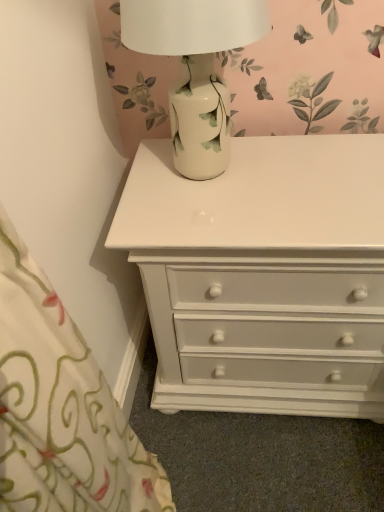
Question: Is porcelain vase at upper center far away from white glossy chest of drawers at center?

Choices:
 (A) no
 (B) yes

Answer: (A)

Question: From a real-world perspective, does porcelain vase at upper center sit lower than white glossy chest of drawers at center?

Choices:
 (A) no
 (B) yes

Answer: (A)

Question: Does porcelain vase at upper center have a lesser height compared to white glossy chest of drawers at center?

Choices:
 (A) no
 (B) yes

Answer: (B)

Question: Does porcelain vase at upper center have a greater height compared to white glossy chest of drawers at center?

Choices:
 (A) no
 (B) yes

Answer: (A)

Question: From a real-world perspective, is porcelain vase at upper center physically above white glossy chest of drawers at center?

Choices:
 (A) yes
 (B) no

Answer: (A)

Question: Is porcelain vase at upper center further to the viewer compared to white glossy chest of drawers at center?

Choices:
 (A) no
 (B) yes

Answer: (A)

Question: From the image's perspective, does white glossy chest of drawers at center appear higher than porcelain vase at upper center?

Choices:
 (A) no
 (B) yes

Answer: (A)

Question: From a real-world perspective, is white glossy chest of drawers at center located beneath porcelain vase at upper center?

Choices:
 (A) yes
 (B) no

Answer: (A)

Question: Is white glossy chest of drawers at center aimed at porcelain vase at upper center?

Choices:
 (A) yes
 (B) no

Answer: (B)

Question: Can you confirm if white glossy chest of drawers at center is bigger than porcelain vase at upper center?

Choices:
 (A) yes
 (B) no

Answer: (A)

Question: Considering the relative sizes of white glossy chest of drawers at center and porcelain vase at upper center in the image provided, is white glossy chest of drawers at center smaller than porcelain vase at upper center?

Choices:
 (A) yes
 (B) no

Answer: (B)

Question: Is white glossy chest of drawers at center thinner than porcelain vase at upper center?

Choices:
 (A) yes
 (B) no

Answer: (B)

Question: Is porcelain vase at upper center to the left or to the right of white glossy chest of drawers at center in the image?

Choices:
 (A) left
 (B) right

Answer: (A)